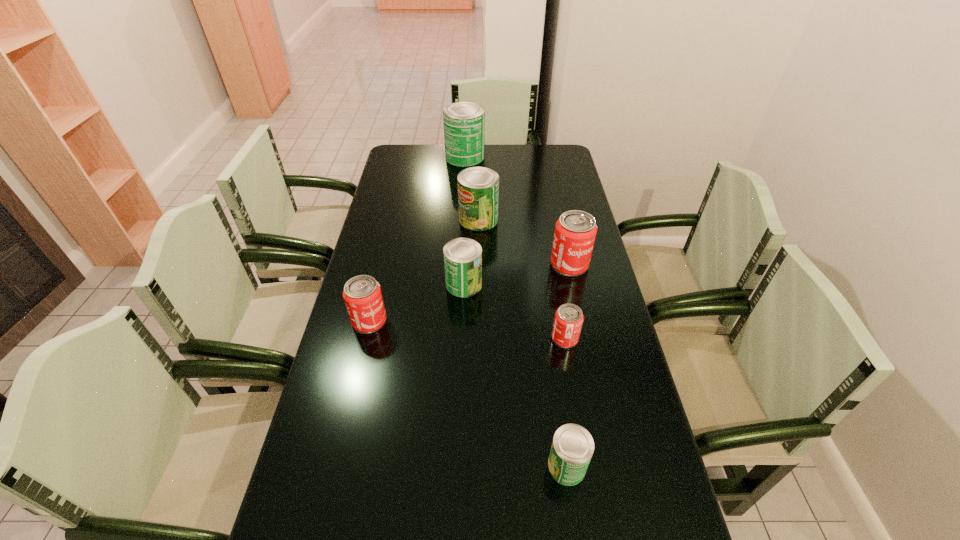
I want to click on the nearest green can, so click(572, 448).

Identify the location of free spot located on the right of the farthest object. Image resolution: width=960 pixels, height=540 pixels. (x=505, y=157).

Where is `vacant area situated on the back of the sixth nearest object`? Image resolution: width=960 pixels, height=540 pixels. vacant area situated on the back of the sixth nearest object is located at coordinates [478, 188].

The width and height of the screenshot is (960, 540). What are the coordinates of `vacant point located 0.390m on the left of the biggest red can` in the screenshot? It's located at 432,265.

Identify the location of free space located 0.340m on the front of the leftmost red can. (339, 453).

Find the location of a particular element. blank area located on the right of the third farthest green can is located at coordinates (545, 285).

I want to click on vacant point located 0.070m on the right of the smallest red can, so click(604, 338).

This screenshot has height=540, width=960. Identify the location of free point located on the left of the rightmost green can. (471, 465).

Locate an element on the screen. Image resolution: width=960 pixels, height=540 pixels. object at the far edge is located at coordinates (463, 122).

Where is `object that is at the left edge`? The width and height of the screenshot is (960, 540). object that is at the left edge is located at coordinates (362, 294).